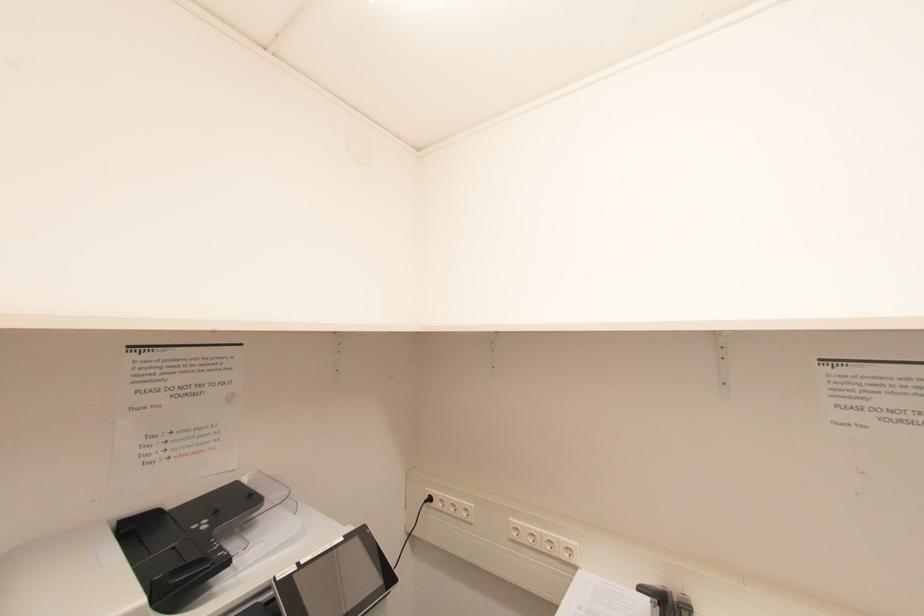
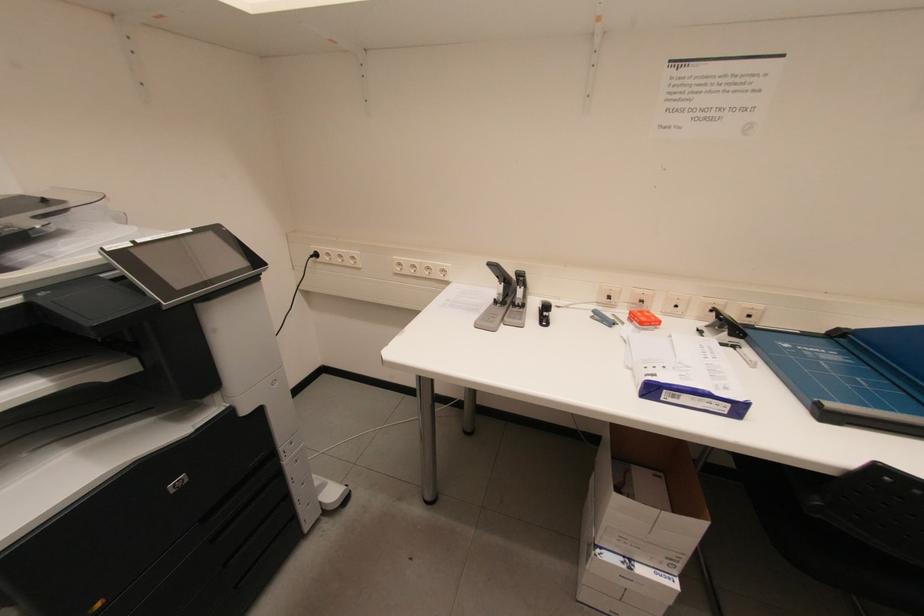
The images are taken continuously from a first-person perspective. In which direction is your viewpoint rotating?

The camera's rotation is toward right-down.